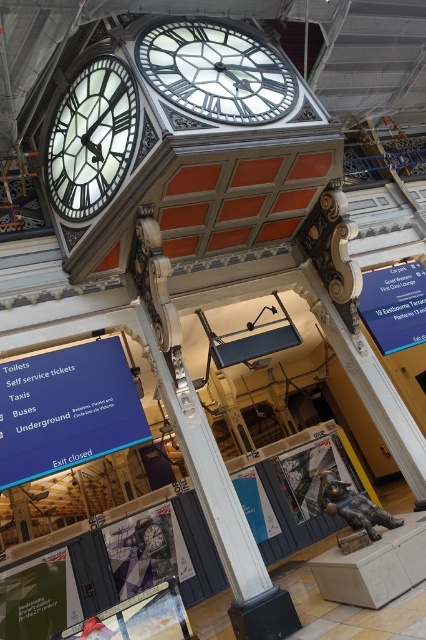
You are standing in the grand train station and want to find the taxis. You see the white glossy clock at upper left and the bronze statue at lower right. Which direction should you look to find the taxi sign mentioned in the services list?

The taxi sign is located near the bronze statue at lower right because the white glossy clock at upper left is on the left side of the bronze statue at lower right, indicating the bronze statue is to the right relative to the clock. Since the services sign lists taxis, it would logically be placed near the bronze statue at lower right where the exits or arrival areas are typically located.

You are a traveler looking for the underground services entrance. You see the matte black sign at center and the blue plastic sign at center right. Which sign is closer to you?

The matte black sign at center is closer to you because the blue plastic sign at center right is behind it.